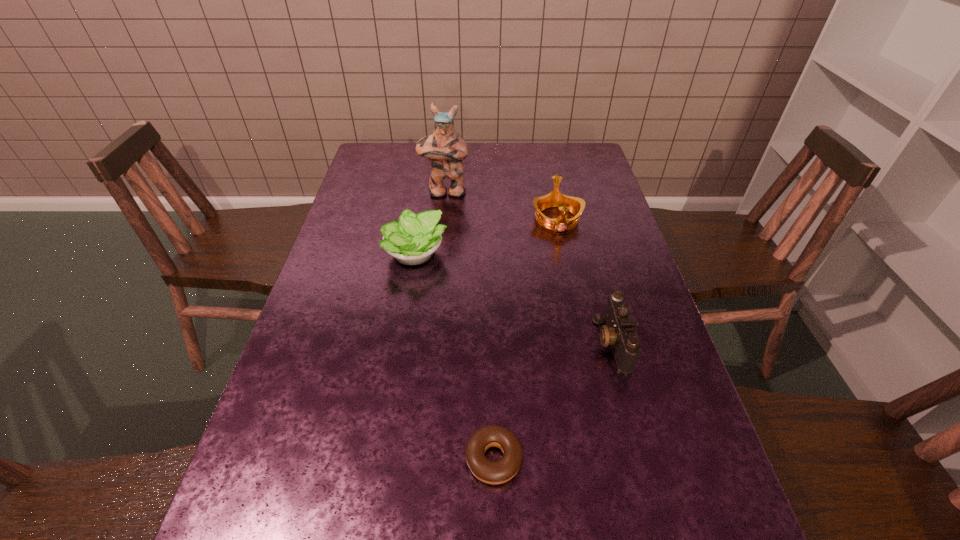
Locate an element on the screen. object that is the third closest to the figurine is located at coordinates (619, 332).